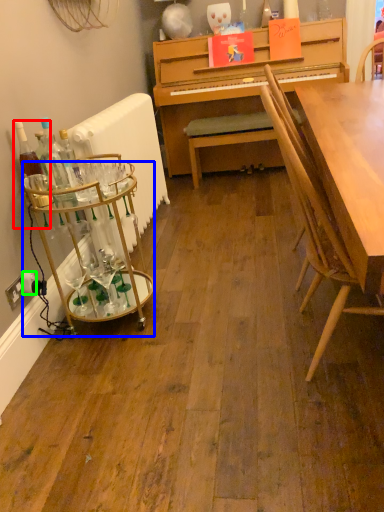
Question: Estimate the real-world distances between objects in this image. Which object is farther from bottle (highlighted by a red box), desk (highlighted by a blue box) or power outlet (highlighted by a green box)?

Choices:
 (A) desk
 (B) power outlet

Answer: (B)